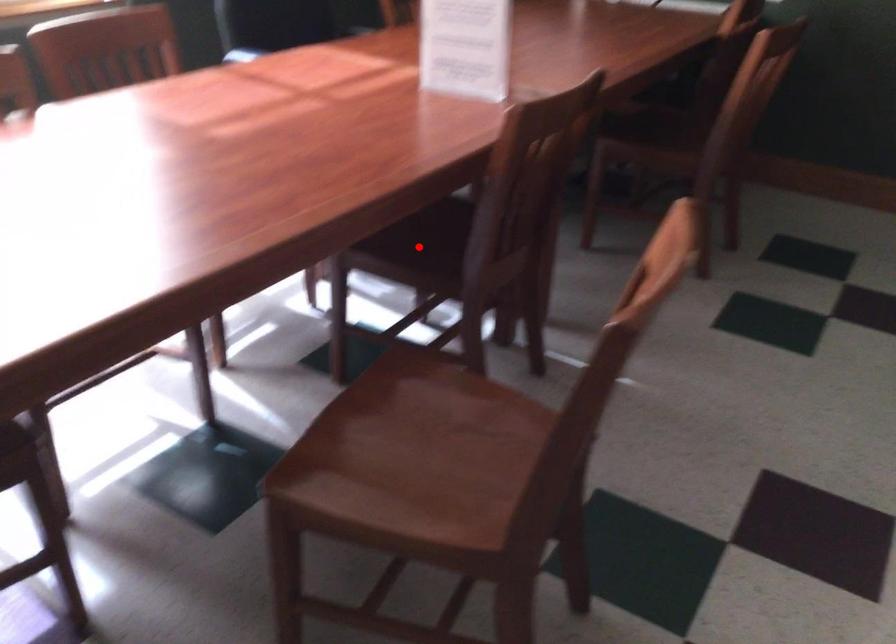
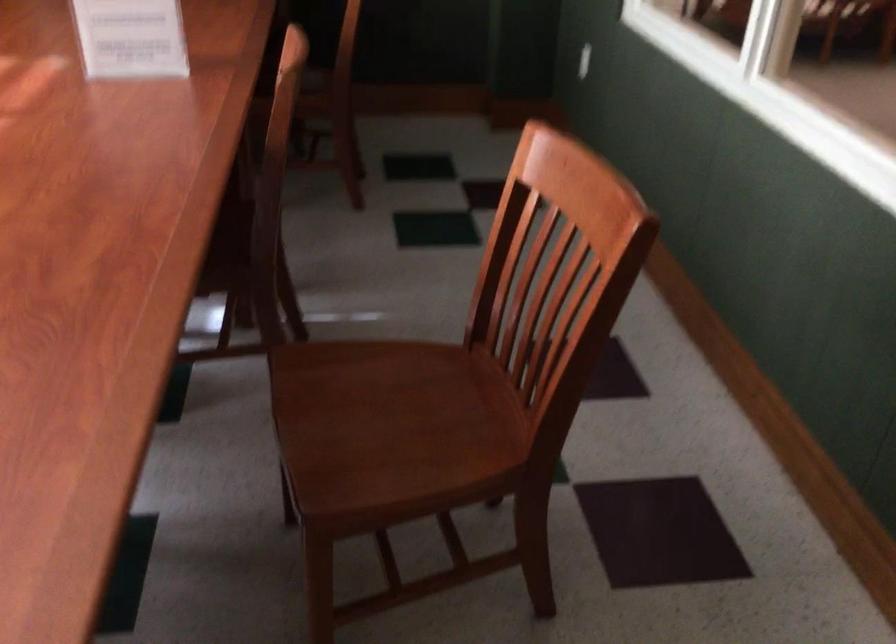
Question: I am providing you with two images of the same scene from different viewpoints. A red point is marked on the first image. At the location where the point appears in image 1, is it still visible in image 2?

Choices:
 (A) Yes
 (B) No

Answer: (B)